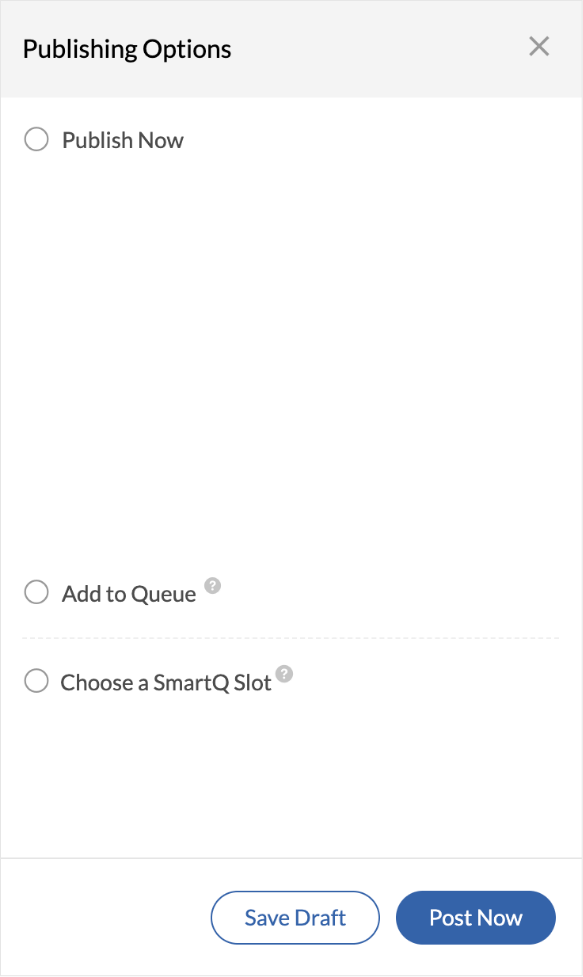
At what (x,y) coordinates should I click in order to perform the action: click on light gray divider bar. Please return your answer as a coordinate pair (x, y). The image size is (583, 977). Looking at the image, I should click on (298, 857).